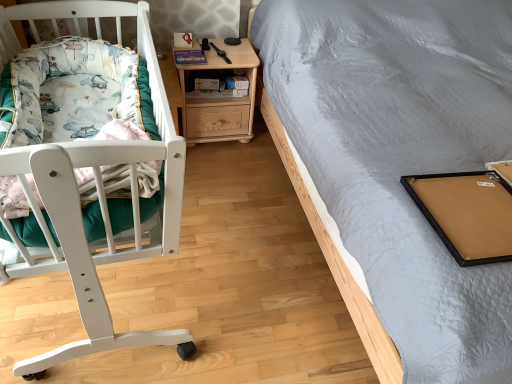
Question: Considering the positions of point (151, 188) and point (207, 127), is point (151, 188) closer or farther from the camera than point (207, 127)?

Choices:
 (A) closer
 (B) farther

Answer: (A)

Question: In terms of size, does fluffy cotton blanket at left appear bigger or smaller than light woodmaterial/texturenightstand at center?

Choices:
 (A) small
 (B) big

Answer: (A)

Question: From a real-world perspective, is fluffy cotton blanket at left positioned above or below light woodmaterial/texturenightstand at center?

Choices:
 (A) above
 (B) below

Answer: (A)

Question: From the image's perspective, relative to fluffy cotton blanket at left, is light woodmaterial/texturenightstand at center above or below?

Choices:
 (A) above
 (B) below

Answer: (A)

Question: Is point (254, 66) positioned closer to the camera than point (23, 195)?

Choices:
 (A) farther
 (B) closer

Answer: (A)

Question: Is light woodmaterial/texturenightstand at center spatially inside fluffy cotton blanket at left, or outside of it?

Choices:
 (A) outside
 (B) inside

Answer: (A)

Question: Considering the relative positions of light woodmaterial/texturenightstand at center and fluffy cotton blanket at left in the image provided, is light woodmaterial/texturenightstand at center to the left or to the right of fluffy cotton blanket at left?

Choices:
 (A) right
 (B) left

Answer: (A)